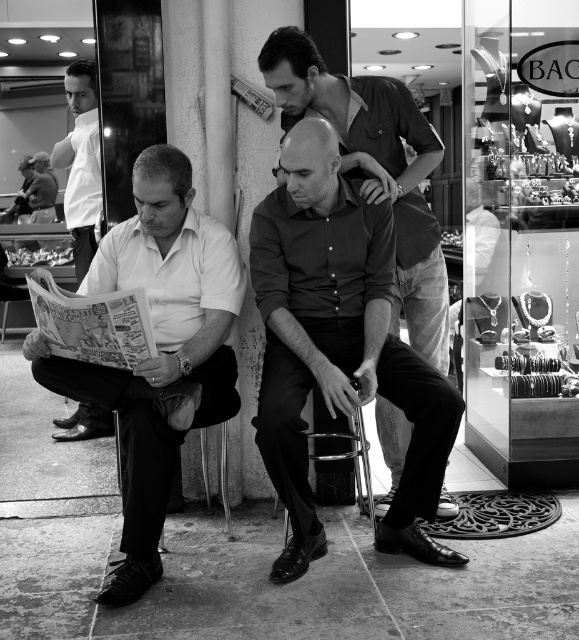
You are a photographer who wants to capture a closeup of the white shirt at left and the metallic silver chair at center. Since you can only focus on one subject at a time, which one should you choose to ensure the other remains in the background?

You should focus on the white shirt at left because it is positioned to the left of the metallic silver chair at center, so the metallic silver chair at center will be in the background.

What are the exact coordinates of the matte white shirt at left in the image?

The exact coordinates of the matte white shirt at left are at point 0.544 in the x axis and 0.273 in the y axis.

Based on the scene description, which man is sitting closer to the viewer? The smooth black shirt at center or the white shirt at left?

The smooth black shirt at center is positioned under the white shirt at left, so the smooth black shirt at center is closer to the viewer.